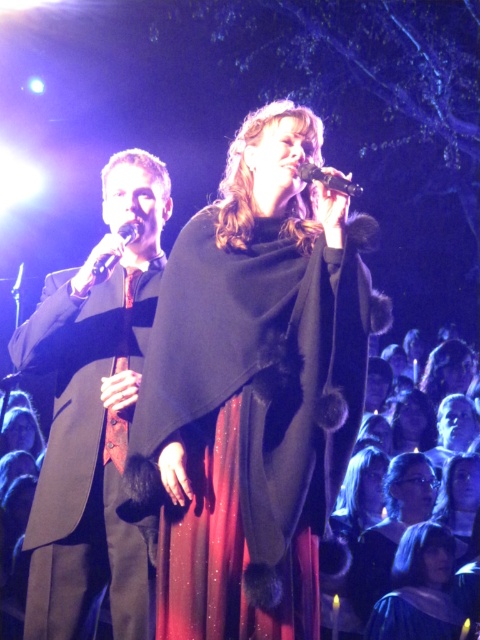
You are a stagehand who needs to adjust the spotlight so it reaches both the velvet burgundy dress at center and the black metallic microphone at upper center. Considering their heights, which object should you focus the spotlight on first to ensure both are illuminated properly?

The velvet burgundy dress at center is taller than the black metallic microphone at upper center, so you should focus the spotlight on the velvet burgundy dress at center first to ensure proper illumination for both.

You are a stagehand preparing to adjust the lighting for the performer wearing the velvet black cape at center and holding the black metallic microphone at upper center. Since the spotlight needs to cover both items, which one requires a wider beam to fully illuminate?

The velvet black cape at center requires a wider spotlight beam because its width surpasses that of the black metallic microphone at upper center.

You are a stagehand preparing to adjust the lighting for the performer wearing the velvet burgundy dress at center and holding the black metallic microphone at upper center. Since the dress is larger, which object should you focus the spotlight on first to ensure both are visible?

The velvet burgundy dress at center is larger than the black metallic microphone at upper center, so you should focus the spotlight on the velvet burgundy dress at center first to ensure it is properly illuminated before adjusting for the smaller microphone.